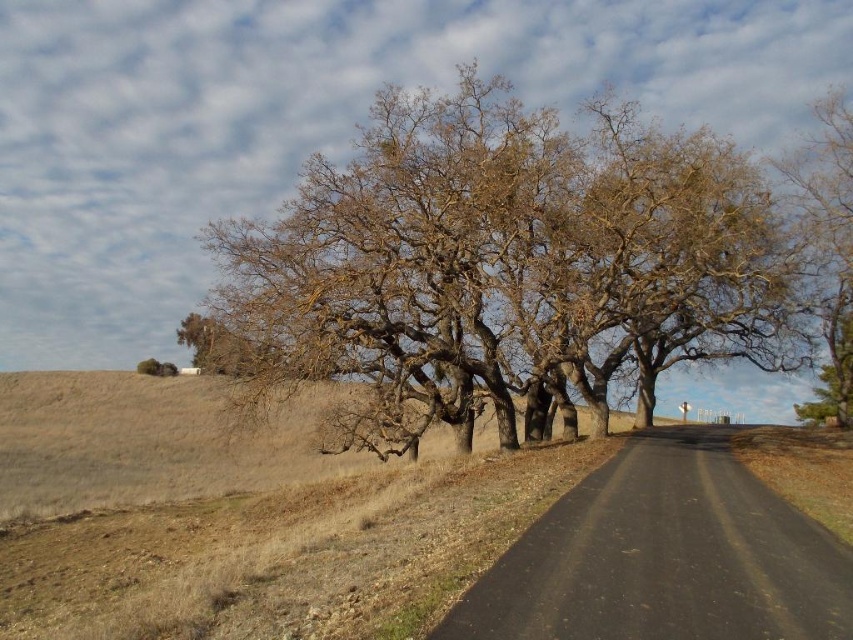
You are standing on the road looking at the tree. There are two points marked on the image. The first point is at coordinate point(161, 492) and the second is at point(844, 413). Which point is closer to you?

Point(161, 492) is closer to you than point(844, 413).

You are driving along the road and see two points marked on the map. The first point is at coordinate point(x=512, y=164) and the second is at point(x=345, y=390). According to the scene, which point is closer to you as you drive along the road?

Point(x=512, y=164) is in front of point(x=345, y=390), so it is closer to you as you drive along the road.